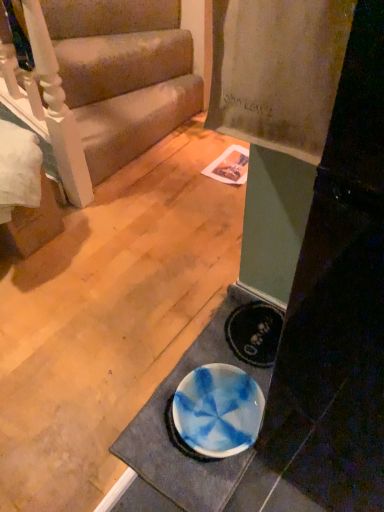
The height and width of the screenshot is (512, 384). Find the location of `empty space that is ontop of beige fabric couch at upper left (from a real-world perspective)`. empty space that is ontop of beige fabric couch at upper left (from a real-world perspective) is located at coordinates (112, 105).